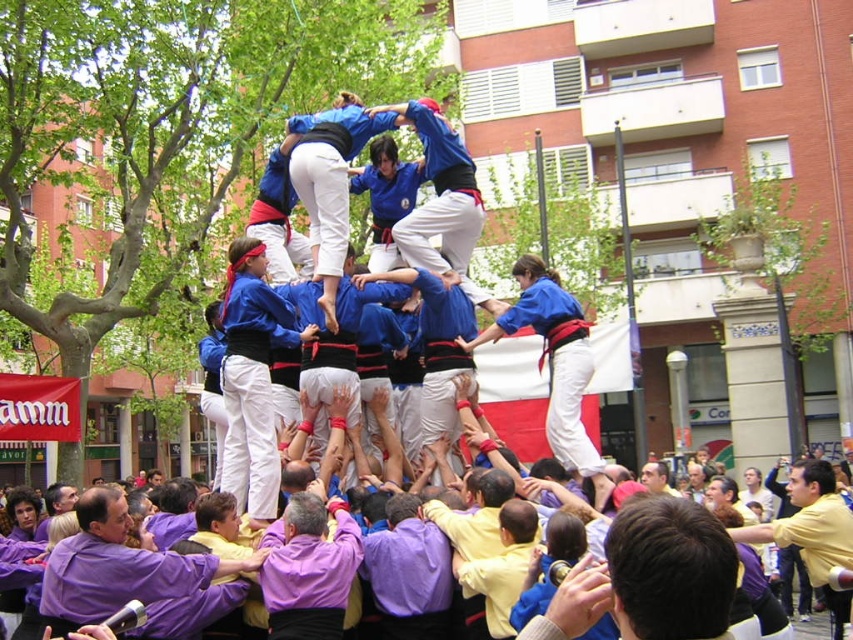
You are a photographer standing at the base of the human tower. You want to take a photo that includes both the purple cotton shirt at center and the yellow matte shirt at center. Given that your camera has a maximum focus range of 40 feet, will you be able to capture both subjects in focus without moving closer?

The purple cotton shirt at center is 45.70 feet from the yellow matte shirt at center. Since the distance between them exceeds the camera maximum focus range of 40 feet, you will not be able to capture both subjects in focus without moving closer.